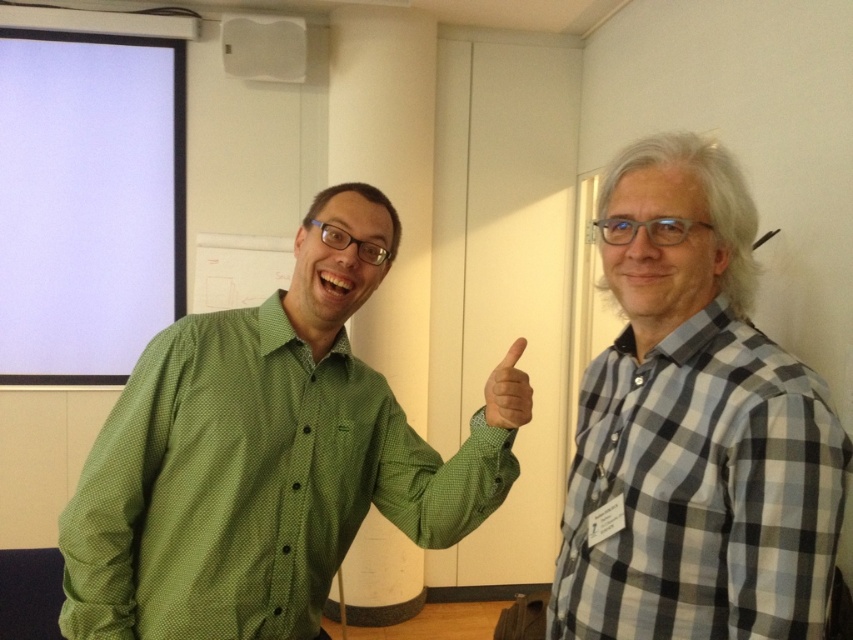
You are standing in a conference room and need to locate the green dotted shirt at left. According to the coordinates provided, where exactly would you find it?

The green dotted shirt at left is located at point coordinates (262, 458).

Consider the image. You are organizing a photo shoot and need to position two props. The green dotted shirt at left and the green matte hand at center are part of the setup. Based on their positions, which prop is closer to the projection screen on the left side?

The green dotted shirt at left is closer to the projection screen on the left side because it is positioned to the left of the green matte hand at center.